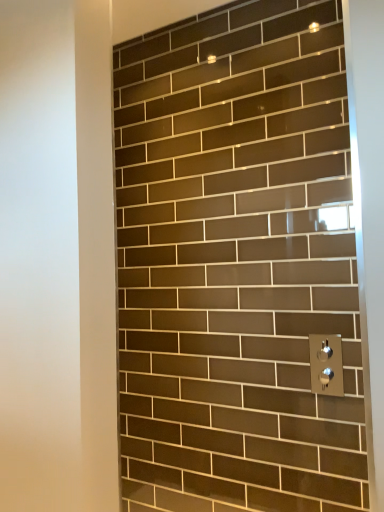
Locate an element on the screen. Image resolution: width=384 pixels, height=512 pixels. polished chrome door handle at center-right is located at coordinates [326, 364].

The width and height of the screenshot is (384, 512). What do you see at coordinates (326, 364) in the screenshot? I see `polished chrome door handle at center-right` at bounding box center [326, 364].

Locate an element on the screen. The image size is (384, 512). polished chrome door handle at center-right is located at coordinates (326, 364).